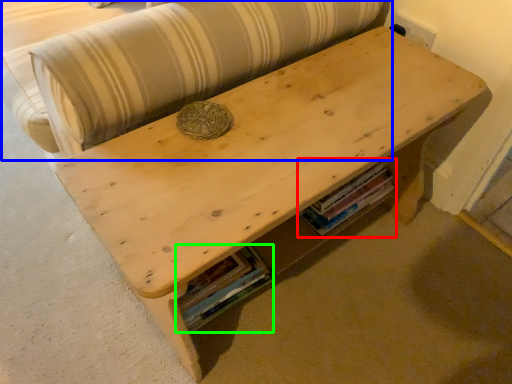
Question: Which object is positioned farthest from book (highlighted by a red box)? Select from couch (highlighted by a blue box) and book (highlighted by a green box).

Choices:
 (A) couch
 (B) book

Answer: (A)